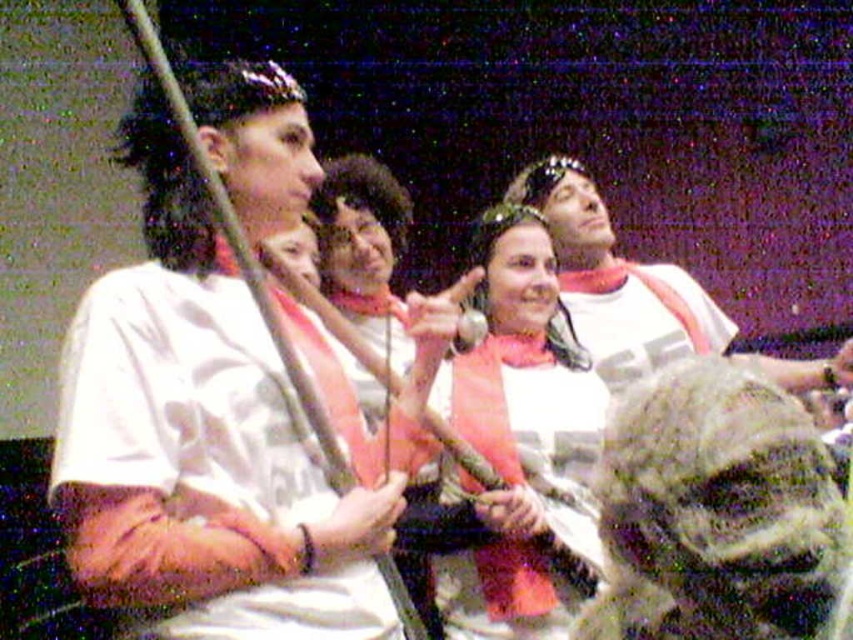
Is point (579, 348) in front of point (630, 312)?

Yes, it is in front of point (630, 312).

Between matte black sword at center and camo fabric shirt at center, which one appears on the left side from the viewer's perspective?

From the viewer's perspective, matte black sword at center appears more on the left side.

Does point (537, 337) lie behind point (664, 362)?

No, it is in front of (664, 362).

Where is `matte black sword at center`? The image size is (853, 640). matte black sword at center is located at coordinates (521, 438).

Can you confirm if white matte shirt at center is taller than white matte shirt at upper center?

Correct, white matte shirt at center is much taller as white matte shirt at upper center.

Is point (196, 500) farther from camera compared to point (619, 292)?

No.

Is point (164, 275) more distant than point (674, 298)?

That is False.

The width and height of the screenshot is (853, 640). In order to click on white matte shirt at center in this screenshot , I will do `click(196, 467)`.

Who is shorter, matte black sword at center or white matte shirt at upper center?

white matte shirt at upper center

Can you confirm if matte black sword at center is positioned below white matte shirt at upper center?

Yes, matte black sword at center is below white matte shirt at upper center.

Is point (489, 600) behind point (668, 324)?

No, it is in front of (668, 324).

You are a GUI agent. You are given a task and a screenshot of the screen. Output one action in this format:
    pyautogui.click(x=<x>, y=<y>)
    Task: Click on the matte black sword at center
    The height and width of the screenshot is (640, 853).
    Given the screenshot: What is the action you would take?
    pyautogui.click(x=521, y=438)